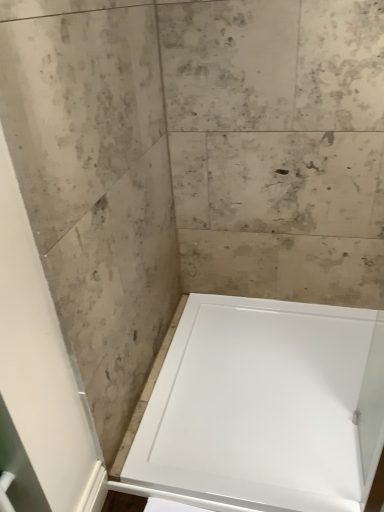
In order to face white glossy bathtub at center, should I rotate leftwards or rightwards?

Turn right by 10.583 degrees to look at white glossy bathtub at center.

Image resolution: width=384 pixels, height=512 pixels. Describe the element at coordinates (264, 404) in the screenshot. I see `white glossy bathtub at center` at that location.

Where is `white glossy bathtub at center`? white glossy bathtub at center is located at coordinates (264, 404).

The image size is (384, 512). What are the coordinates of `white glossy bathtub at center` in the screenshot? It's located at (264, 404).